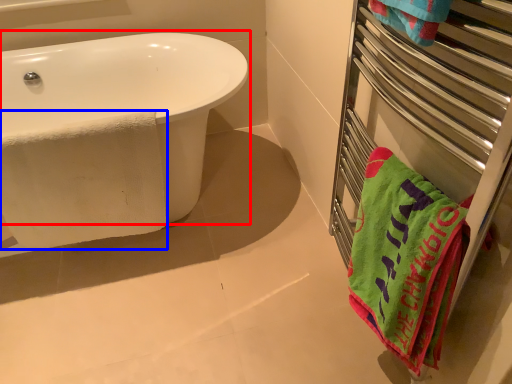
Question: Which of the following is the farthest to the observer, bathtub (highlighted by a red box) or beach towel (highlighted by a blue box)?

Choices:
 (A) bathtub
 (B) beach towel

Answer: (B)